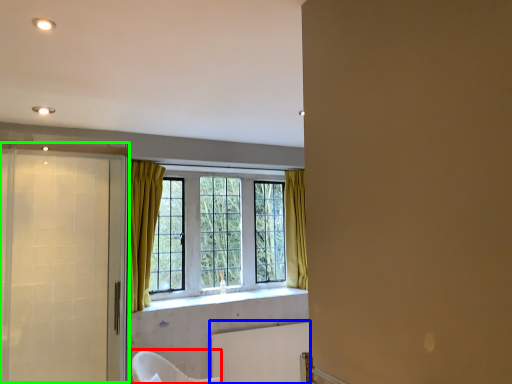
Question: Based on their relative distances, which object is farther from armchair (highlighted by a red box)? Choose from radiator (highlighted by a blue box) and screen door (highlighted by a green box).

Choices:
 (A) radiator
 (B) screen door

Answer: (B)